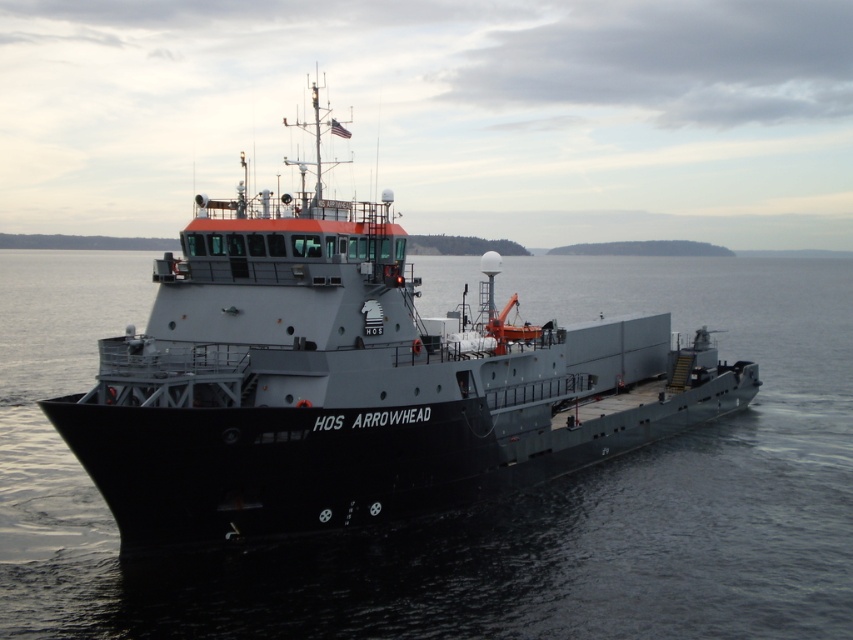
Can you confirm if black matte water at center is taller than black matte ship at center?

In fact, black matte water at center may be shorter than black matte ship at center.

Between point (686, 276) and point (469, 308), which one is positioned in front?

Point (469, 308) is more forward.

The width and height of the screenshot is (853, 640). I want to click on black matte water at center, so click(x=477, y=508).